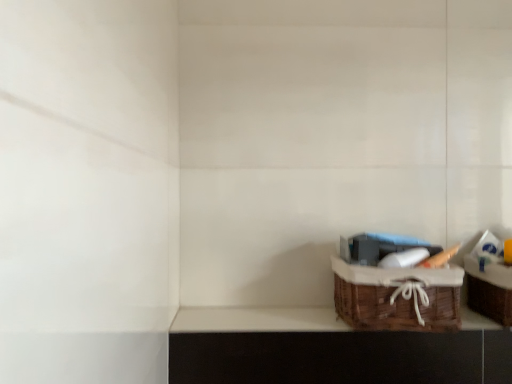
Where is `free space above brown wicker basket at lower right (from a real-world perspective)`? free space above brown wicker basket at lower right (from a real-world perspective) is located at coordinates (297, 320).